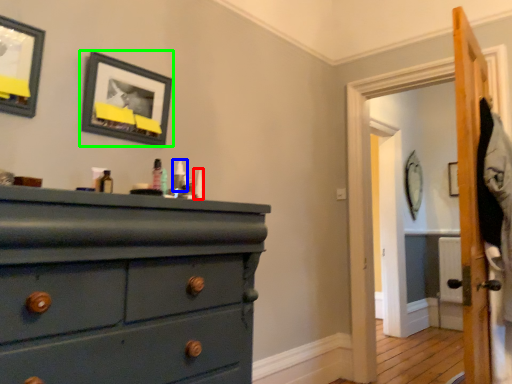
Question: Considering the real-world distances, which object is farthest from toiletry (highlighted by a red box)? toiletry (highlighted by a blue box) or picture frame (highlighted by a green box)?

Choices:
 (A) toiletry
 (B) picture frame

Answer: (B)